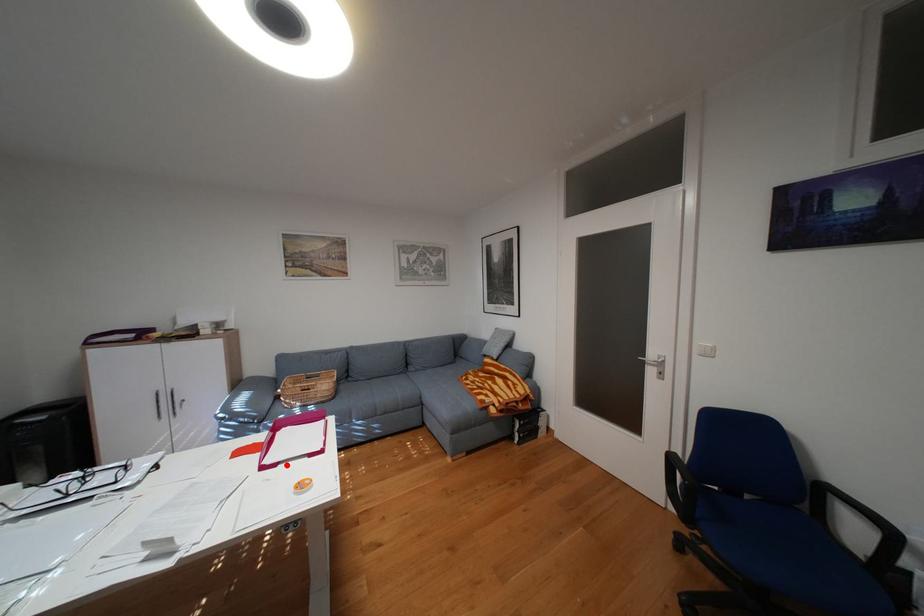
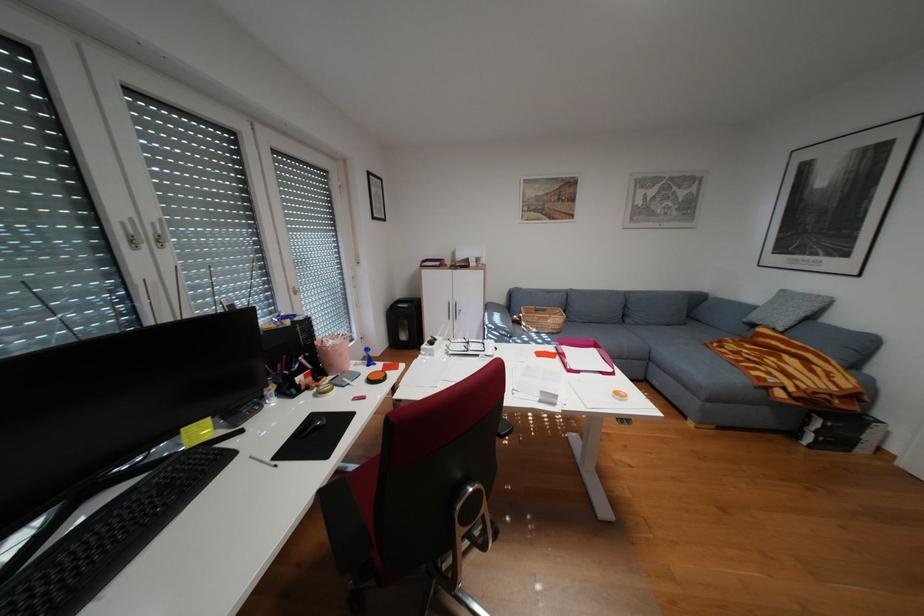
Find the pixel in the second image that matches the highlighted location in the first image.

(590, 371)